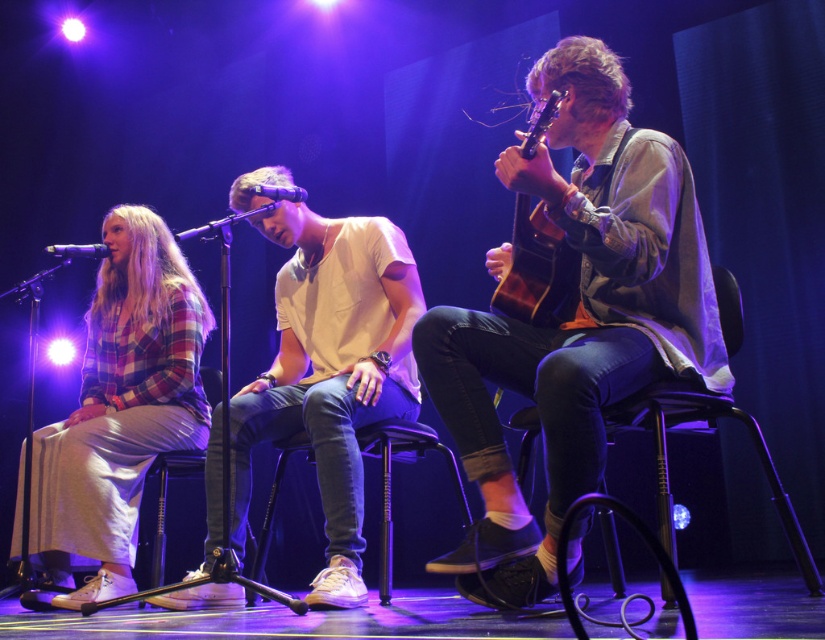
Question: Which point appears closest to the camera in this image?

Choices:
 (A) (182, 276)
 (B) (648, 413)
 (C) (286, 237)

Answer: (B)

Question: Does wooden acoustic guitar at right lie in front of metallic silver microphone at center?

Choices:
 (A) no
 (B) yes

Answer: (B)

Question: Is denim jeans at center to the left of metallic silver microphone at center from the viewer's perspective?

Choices:
 (A) no
 (B) yes

Answer: (A)

Question: Among these points, which one is nearest to the camera?

Choices:
 (A) (196, 605)
 (B) (72, 257)
 (C) (600, 298)
 (D) (285, 188)

Answer: (C)

Question: Can you confirm if black plastic chair at right is smaller than metallic silver microphone at center?

Choices:
 (A) yes
 (B) no

Answer: (B)

Question: Among these points, which one is farthest from the camera?

Choices:
 (A) (385, 538)
 (B) (724, 388)

Answer: (A)